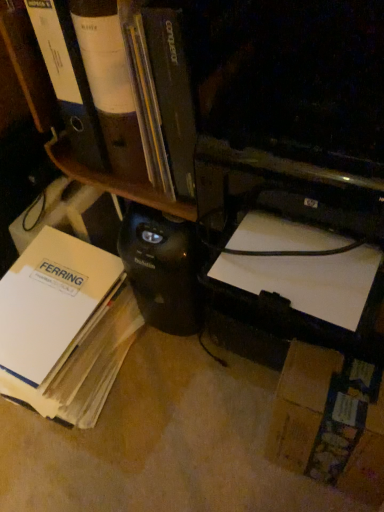
Question: Can you confirm if matte black bookshelf at upper center is taller than white paper at lower left?

Choices:
 (A) no
 (B) yes

Answer: (B)

Question: Is matte black bookshelf at upper center facing towards white paper at lower left?

Choices:
 (A) no
 (B) yes

Answer: (A)

Question: Is white paper at lower left inside matte black bookshelf at upper center?

Choices:
 (A) no
 (B) yes

Answer: (A)

Question: Is matte black bookshelf at upper center to the right of white paper at lower left from the viewer's perspective?

Choices:
 (A) yes
 (B) no

Answer: (A)

Question: Would you consider matte black bookshelf at upper center to be distant from white paper at lower left?

Choices:
 (A) yes
 (B) no

Answer: (B)

Question: Does matte black bookshelf at upper center have a lesser height compared to white paper at lower left?

Choices:
 (A) yes
 (B) no

Answer: (B)

Question: Can you confirm if white paper at lower left is bigger than matte black bookshelf at upper center?

Choices:
 (A) yes
 (B) no

Answer: (A)

Question: Is the position of white paper at lower left less distant than that of matte black bookshelf at upper center?

Choices:
 (A) no
 (B) yes

Answer: (A)

Question: Is white paper at lower left at the right side of matte black bookshelf at upper center?

Choices:
 (A) yes
 (B) no

Answer: (B)

Question: Is white paper at lower left next to matte black bookshelf at upper center and touching it?

Choices:
 (A) yes
 (B) no

Answer: (B)

Question: From a real-world perspective, is white paper at lower left over matte black bookshelf at upper center?

Choices:
 (A) no
 (B) yes

Answer: (A)

Question: Is matte black bookshelf at upper center at the back of white paper at lower left?

Choices:
 (A) yes
 (B) no

Answer: (B)

Question: Is white paper at lower left situated inside matte black bookshelf at upper center or outside?

Choices:
 (A) outside
 (B) inside

Answer: (A)